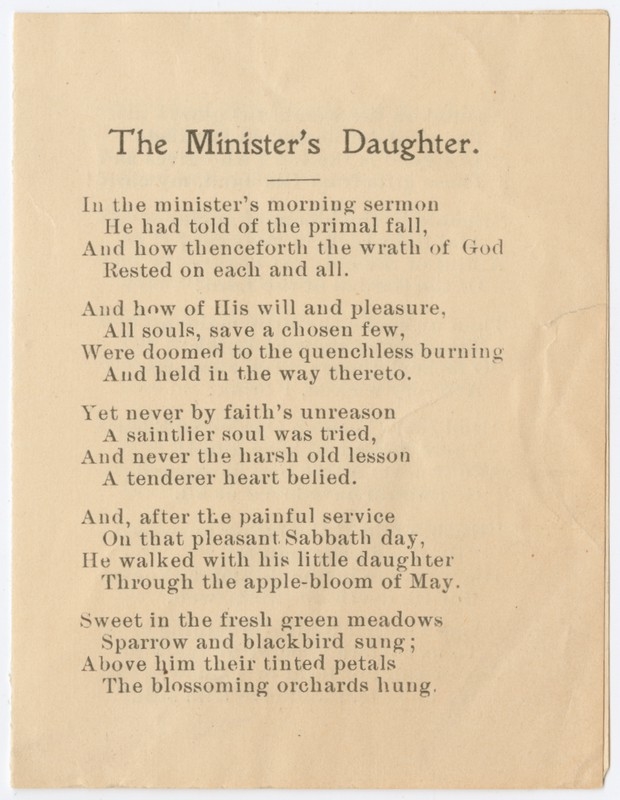
Where is `sheet of paper`? This screenshot has height=800, width=620. sheet of paper is located at coordinates (49, 410).